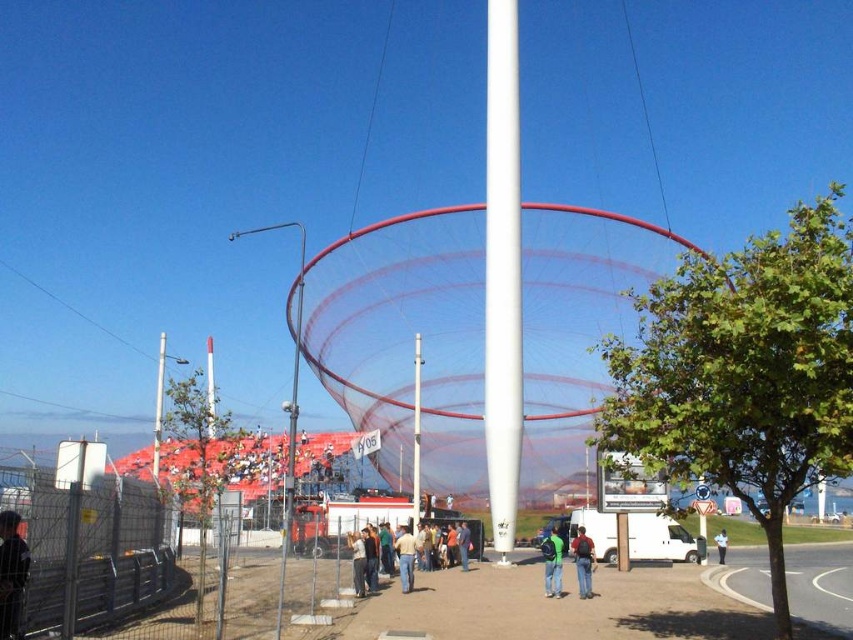
Who is positioned more to the left, tan fabric shirt at center or green fabric jacket at center?

tan fabric shirt at center

Is tan fabric shirt at center below green fabric jacket at center?

No.

Find the location of a particular element. This screenshot has height=640, width=853. tan fabric shirt at center is located at coordinates (405, 557).

Who is positioned more to the right, white smooth pole at center or white matte mast at center?

From the viewer's perspective, white smooth pole at center appears more on the right side.

Where is `white smooth pole at center`? white smooth pole at center is located at coordinates (502, 275).

Describe the element at coordinates (502, 275) in the screenshot. I see `white smooth pole at center` at that location.

At what (x,y) coordinates should I click in order to perform the action: click on white smooth pole at center. Please return your answer as a coordinate pair (x, y). This screenshot has height=640, width=853. Looking at the image, I should click on (502, 275).

Does white smooth pole at center appear on the right side of white glossy pole at center?

Yes, white smooth pole at center is to the right of white glossy pole at center.

Consider the image. Between white smooth pole at center and white glossy pole at center, which one has less height?

With less height is white glossy pole at center.

I want to click on white smooth pole at center, so click(502, 275).

Identify the location of white smooth pole at center. The image size is (853, 640). (502, 275).